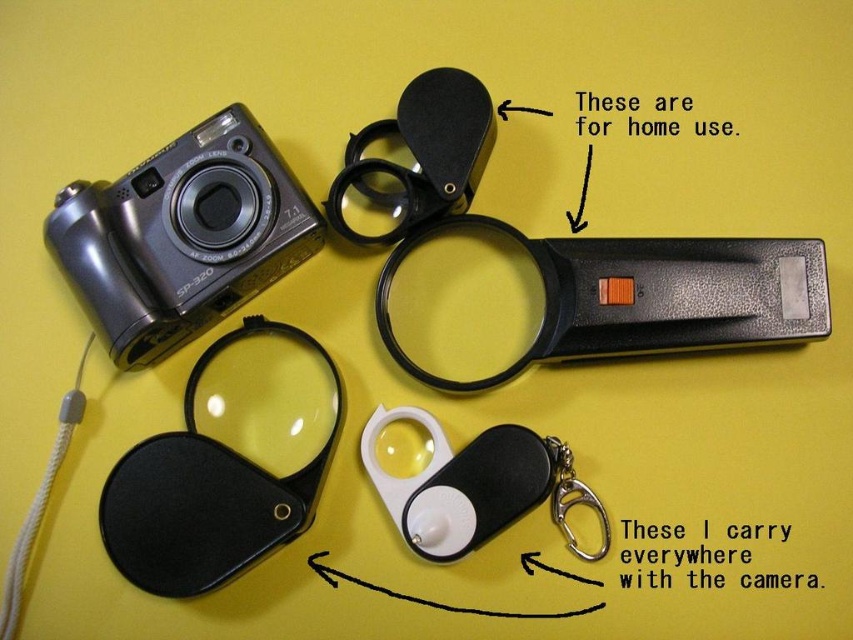
Can you confirm if matte black camera at upper left is thinner than black matte lens filter at lower left?

In fact, matte black camera at upper left might be wider than black matte lens filter at lower left.

This screenshot has height=640, width=853. What do you see at coordinates (183, 236) in the screenshot?
I see `matte black camera at upper left` at bounding box center [183, 236].

Is point (100, 253) more distant than point (271, 332)?

No, it is in front of (271, 332).

Identify the location of matte black camera at upper left. Image resolution: width=853 pixels, height=640 pixels. 183,236.

Who is shorter, matte black camera at upper left or metallic silver keychain at lower center?

Standing shorter between the two is metallic silver keychain at lower center.

Does matte black camera at upper left appear on the left side of metallic silver keychain at lower center?

Yes, matte black camera at upper left is to the left of metallic silver keychain at lower center.

Describe the element at coordinates (183, 236) in the screenshot. I see `matte black camera at upper left` at that location.

Image resolution: width=853 pixels, height=640 pixels. I want to click on matte black camera at upper left, so click(x=183, y=236).

Does black matte lens filter at lower left have a lesser width compared to metallic silver keychain at lower center?

Incorrect, black matte lens filter at lower left's width is not less than metallic silver keychain at lower center's.

Which is behind, point (193, 432) or point (582, 557)?

The point (193, 432) is behind.

Does point (215, 465) come in front of point (592, 500)?

Yes, point (215, 465) is closer to viewer.

Where is `black matte lens filter at lower left`? The image size is (853, 640). black matte lens filter at lower left is located at coordinates click(206, 496).